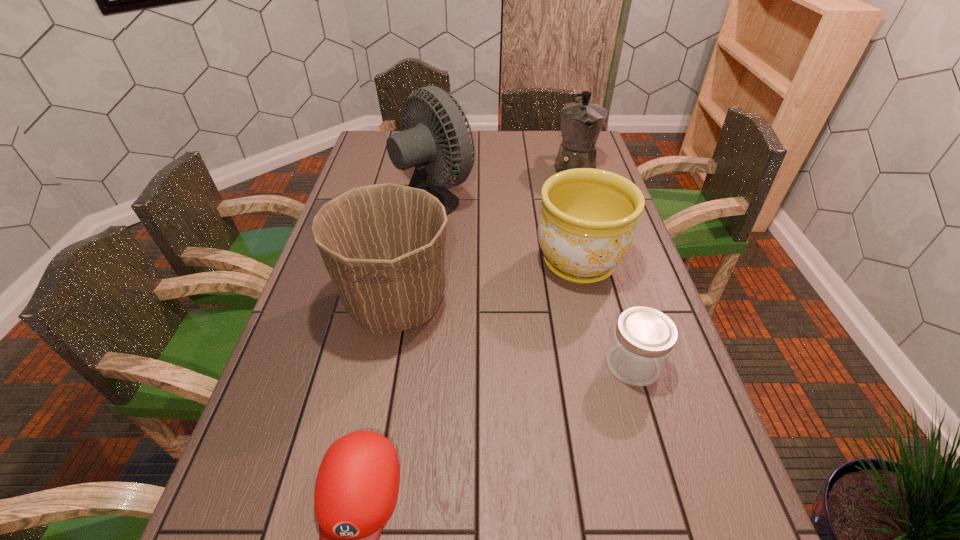
Identify the location of free space between the fifth tallest object and the fourth tallest object. (606, 314).

Identify the location of vacant space that is in between the fan and the jar. Image resolution: width=960 pixels, height=540 pixels. (531, 282).

Find the location of `vacant area that lies between the jar and the tallest object`. vacant area that lies between the jar and the tallest object is located at coordinates (531, 282).

The image size is (960, 540). I want to click on free space that is in between the fan and the jar, so click(531, 282).

Find the location of a particular element. This screenshot has width=960, height=540. vacant region between the tallest object and the coffeepot is located at coordinates (501, 183).

Where is `free space between the shorter flowerpot and the tallest object`? free space between the shorter flowerpot and the tallest object is located at coordinates (504, 231).

What are the coordinates of `object that stands as the closest to the tallest object` in the screenshot? It's located at (587, 224).

You are a GUI agent. You are given a task and a screenshot of the screen. Output one action in this format:
    pyautogui.click(x=<x>, y=<y>)
    Task: Click on the fifth closest object to the coffeepot
    The width and height of the screenshot is (960, 540).
    Given the screenshot: What is the action you would take?
    pyautogui.click(x=357, y=485)

You are a GUI agent. You are given a task and a screenshot of the screen. Output one action in this format:
    pyautogui.click(x=<x>, y=<y>)
    Task: Click on the blank area in the image that satisfies the following two spatial constraints: 1. on the pouring side of the coffeepot; 2. in front of the tallest object to direct airflow
    
    Given the screenshot: What is the action you would take?
    pyautogui.click(x=584, y=199)

You are a GUI agent. You are given a task and a screenshot of the screen. Output one action in this format:
    pyautogui.click(x=<x>, y=<y>)
    Task: Click on the vacant area that satisfies the following two spatial constraints: 1. in front of the tallest object to direct airflow; 2. on the back side of the fourth tallest object
    This screenshot has height=540, width=960.
    Given the screenshot: What is the action you would take?
    [x=420, y=263]